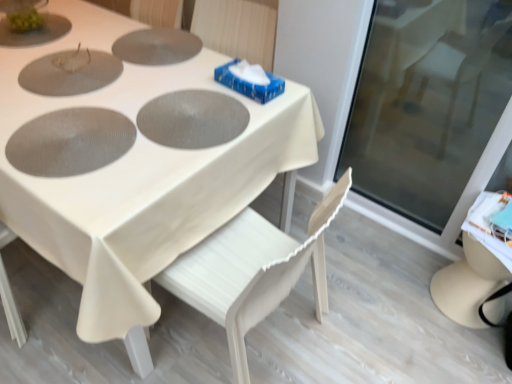
Question: Is white wood chair at center to the left of gray matte pizza pan at center, which is the second pizza pan in back-to-front order, from the viewer's perspective?

Choices:
 (A) yes
 (B) no

Answer: (B)

Question: Is gray matte pizza pan at center, which is the second pizza pan from front to back, at the back of white wood chair at center?

Choices:
 (A) no
 (B) yes

Answer: (A)

Question: From the image's perspective, would you say white wood chair at center is shown under gray matte pizza pan at center, which is the second pizza pan from front to back?

Choices:
 (A) yes
 (B) no

Answer: (A)

Question: From a real-world perspective, is white wood chair at center positioned under gray matte pizza pan at center, which is the second pizza pan from front to back, based on gravity?

Choices:
 (A) no
 (B) yes

Answer: (B)

Question: Would you say white wood chair at center is outside gray matte pizza pan at center, which is the second pizza pan from front to back?

Choices:
 (A) no
 (B) yes

Answer: (B)

Question: From a real-world perspective, is white wood chair at center over gray matte pizza pan at center, which is the second pizza pan from front to back?

Choices:
 (A) no
 (B) yes

Answer: (A)

Question: Would you say gray matte pizza pan at center, which is the second pizza pan from front to back, is a long distance from matte gray pizza pan at center, which is counted as the 1th pizza pan, starting from the front?

Choices:
 (A) no
 (B) yes

Answer: (A)

Question: Can you confirm if gray matte pizza pan at center, which is the second pizza pan in back-to-front order, is positioned to the right of matte gray pizza pan at center, which appears as the third pizza pan when viewed from the back?

Choices:
 (A) yes
 (B) no

Answer: (A)

Question: From the image's perspective, is gray matte pizza pan at center, which is the second pizza pan from front to back, located beneath matte gray pizza pan at center, which appears as the third pizza pan when viewed from the back?

Choices:
 (A) yes
 (B) no

Answer: (B)

Question: Is gray matte pizza pan at center, which is the second pizza pan in back-to-front order, surrounding matte gray pizza pan at center, which appears as the third pizza pan when viewed from the back?

Choices:
 (A) yes
 (B) no

Answer: (B)

Question: From a real-world perspective, does gray matte pizza pan at center, which is the second pizza pan in back-to-front order, stand above matte gray pizza pan at center, which is counted as the 1th pizza pan, starting from the front?

Choices:
 (A) yes
 (B) no

Answer: (B)

Question: Considering the relative positions of gray matte pizza pan at center, which is the second pizza pan in back-to-front order, and matte gray pizza pan at center, which is counted as the 1th pizza pan, starting from the front, in the image provided, is gray matte pizza pan at center, which is the second pizza pan in back-to-front order, to the left of matte gray pizza pan at center, which is counted as the 1th pizza pan, starting from the front, from the viewer's perspective?

Choices:
 (A) yes
 (B) no

Answer: (B)

Question: Is white wood chair at center further to camera compared to matte gray pizza pan at center, which is counted as the 1th pizza pan, starting from the front?

Choices:
 (A) no
 (B) yes

Answer: (A)